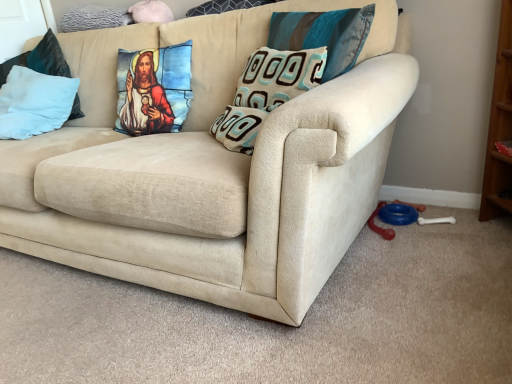
The image size is (512, 384). What do you see at coordinates (154, 89) in the screenshot? I see `printed fabric pillow at center, placed as the 4th pillow when sorted from right to left` at bounding box center [154, 89].

The width and height of the screenshot is (512, 384). What do you see at coordinates (34, 103) in the screenshot?
I see `light blue plush pillow at left, which appears as the first pillow when viewed from the left` at bounding box center [34, 103].

You are a GUI agent. You are given a task and a screenshot of the screen. Output one action in this format:
    pyautogui.click(x=<x>, y=<y>)
    Task: Click on the teal fabric pillow at upper center, which is counted as the fifth pillow, starting from the left
    This screenshot has height=384, width=512.
    Given the screenshot: What is the action you would take?
    pyautogui.click(x=324, y=35)

Between teal fabric pillow at upper center, which is counted as the fifth pillow, starting from the left, and printed fabric pillow at center, placed as the 4th pillow when sorted from right to left, which one has more height?

printed fabric pillow at center, placed as the 4th pillow when sorted from right to left, is taller.

Is teal fabric pillow at upper center, the first pillow from the right, with printed fabric pillow at center, placed as the 4th pillow when sorted from right to left?

teal fabric pillow at upper center, the first pillow from the right, and printed fabric pillow at center, placed as the 4th pillow when sorted from right to left, are clearly separated.

Is teal fabric pillow at upper center, which is counted as the fifth pillow, starting from the left, facing towards printed fabric pillow at center, marked as the 2th pillow in a left-to-right arrangement?

No.

From a real-world perspective, does teal fabric pillow at upper center, the first pillow from the right, stand above printed fabric pillow at center, placed as the 4th pillow when sorted from right to left?

Yes.

Is printed fabric pillow at center, marked as the 2th pillow in a left-to-right arrangement, oriented towards teal fabric pillow at upper center, which is the 3th pillow from left to right?

No, printed fabric pillow at center, marked as the 2th pillow in a left-to-right arrangement, is not aimed at teal fabric pillow at upper center, which is the 3th pillow from left to right.

Considering the relative positions of printed fabric pillow at center, placed as the 4th pillow when sorted from right to left, and teal fabric pillow at upper center, which is the 3th pillow from left to right, in the image provided, is printed fabric pillow at center, placed as the 4th pillow when sorted from right to left, to the right of teal fabric pillow at upper center, which is the 3th pillow from left to right, from the viewer's perspective?

Incorrect, printed fabric pillow at center, placed as the 4th pillow when sorted from right to left, is not on the right side of teal fabric pillow at upper center, which is the 3th pillow from left to right.

Can you tell me how much printed fabric pillow at center, marked as the 2th pillow in a left-to-right arrangement, and teal fabric pillow at upper center, which is the 3th pillow from left to right, differ in facing direction?

7.07e-05 degrees separate the facing orientations of printed fabric pillow at center, marked as the 2th pillow in a left-to-right arrangement, and teal fabric pillow at upper center, which is the 3th pillow from left to right.

From the image's perspective, which is above, printed fabric pillow at center, marked as the 2th pillow in a left-to-right arrangement, or teal fabric pillow at upper center, which is the 3th pillow from left to right?

teal fabric pillow at upper center, which is the 3th pillow from left to right, from the image's perspective.

Considering the relative positions of teal fabric pillow at upper center, the first pillow from the right, and light blue plush pillow at left, which appears as the first pillow when viewed from the left, in the image provided, is teal fabric pillow at upper center, the first pillow from the right, behind light blue plush pillow at left, which appears as the first pillow when viewed from the left,?

No, teal fabric pillow at upper center, the first pillow from the right, is in front of light blue plush pillow at left, which appears as the first pillow when viewed from the left.

Is teal fabric pillow at upper center, which is counted as the fifth pillow, starting from the left, turned away from light blue plush pillow at left, which appears as the first pillow when viewed from the left?

No.

Between point (319, 22) and point (23, 77), which one is positioned in front?

The point (319, 22) is closer.

From the image's perspective, which one is positioned lower, teal fabric pillow at upper center, the first pillow from the right, or light blue plush pillow at left, the 5th pillow viewed from the right?

light blue plush pillow at left, the 5th pillow viewed from the right, from the image's perspective.

From a real-world perspective, starting from the teal and brown textured pillow at center, acting as the second pillow starting from the right, which pillow is the 1st one vertically above it? Please provide its 2D coordinates.

[(154, 89)]

Considering the positions of objects teal and brown textured pillow at center, the fourth pillow viewed from the left, and printed fabric pillow at center, placed as the 4th pillow when sorted from right to left, in the image provided, who is behind, teal and brown textured pillow at center, the fourth pillow viewed from the left, or printed fabric pillow at center, placed as the 4th pillow when sorted from right to left,?

printed fabric pillow at center, placed as the 4th pillow when sorted from right to left, is more distant.

Which point is more forward, (272, 63) or (179, 98)?

The point (272, 63) is closer.

From the image's perspective, between teal and brown textured pillow at center, the fourth pillow viewed from the left, and printed fabric pillow at center, placed as the 4th pillow when sorted from right to left, who is located below?

teal and brown textured pillow at center, the fourth pillow viewed from the left, from the image's perspective.

Which pillow is the 2nd one when counting from the back of the printed fabric pillow at center, placed as the 4th pillow when sorted from right to left? Please provide its 2D coordinates.

[(34, 103)]

Considering the positions of objects light blue plush pillow at left, the 5th pillow viewed from the right, and printed fabric pillow at center, placed as the 4th pillow when sorted from right to left, in the image provided, who is more to the right, light blue plush pillow at left, the 5th pillow viewed from the right, or printed fabric pillow at center, placed as the 4th pillow when sorted from right to left,?

printed fabric pillow at center, placed as the 4th pillow when sorted from right to left.

Which object is further away from the camera, light blue plush pillow at left, which appears as the first pillow when viewed from the left, or printed fabric pillow at center, placed as the 4th pillow when sorted from right to left?

light blue plush pillow at left, which appears as the first pillow when viewed from the left, is more distant.

Is light blue plush pillow at left, the 5th pillow viewed from the right, aimed at printed fabric pillow at center, placed as the 4th pillow when sorted from right to left?

No, light blue plush pillow at left, the 5th pillow viewed from the right, is not facing towards printed fabric pillow at center, placed as the 4th pillow when sorted from right to left.

Find the location of a particular element. studio couch below the printed fabric pillow at center, marked as the 2th pillow in a left-to-right arrangement (from a real-world perspective) is located at coordinates (211, 171).

Considering the sizes of objects printed fabric pillow at center, placed as the 4th pillow when sorted from right to left, and beige fabric couch at center in the image provided, who is taller, printed fabric pillow at center, placed as the 4th pillow when sorted from right to left, or beige fabric couch at center?

beige fabric couch at center is taller.

Would you say printed fabric pillow at center, placed as the 4th pillow when sorted from right to left, is to the left or to the right of beige fabric couch at center in the picture?

printed fabric pillow at center, placed as the 4th pillow when sorted from right to left, is to the right of beige fabric couch at center.

Looking at the image, does printed fabric pillow at center, placed as the 4th pillow when sorted from right to left, seem bigger or smaller compared to beige fabric couch at center?

In the image, printed fabric pillow at center, placed as the 4th pillow when sorted from right to left, appears to be smaller than beige fabric couch at center.

From a real-world perspective, who is located lower, printed fabric pillow at center, marked as the 2th pillow in a left-to-right arrangement, or teal fabric pillow at upper center, which is counted as the fifth pillow, starting from the left?

In real-world perspective, printed fabric pillow at center, marked as the 2th pillow in a left-to-right arrangement, is lower.

Considering the positions of points (156, 112) and (356, 57), is point (156, 112) farther from camera compared to point (356, 57)?

That is True.

Can teal fabric pillow at upper center, the first pillow from the right, be found inside printed fabric pillow at center, marked as the 2th pillow in a left-to-right arrangement?

No.

Image resolution: width=512 pixels, height=384 pixels. There is a teal fabric pillow at upper center, which is counted as the fifth pillow, starting from the left. Find the location of `the 1st pillow below it (from the image's perspective)`. the 1st pillow below it (from the image's perspective) is located at coordinates (154, 89).

From the image's perspective, which pillow is the 2nd one above the printed fabric pillow at center, placed as the 4th pillow when sorted from right to left? Please provide its 2D coordinates.

[(225, 6)]

From the image, which object appears to be farther from teal fabric pillow at upper center, which is counted as the fifth pillow, starting from the left, printed fabric pillow at center, placed as the 4th pillow when sorted from right to left, or teal and brown textured pillow at center, the fourth pillow viewed from the left?

printed fabric pillow at center, placed as the 4th pillow when sorted from right to left, is positioned further to the anchor teal fabric pillow at upper center, which is counted as the fifth pillow, starting from the left.

Based on their spatial positions, is printed fabric pillow at center, marked as the 2th pillow in a left-to-right arrangement, or beige fabric couch at center closer to teal fabric pillow at upper center, the 3th pillow in the right-to-left sequence?

Based on the image, printed fabric pillow at center, marked as the 2th pillow in a left-to-right arrangement, appears to be nearer to teal fabric pillow at upper center, the 3th pillow in the right-to-left sequence.

From the image, which object appears to be farther from teal fabric pillow at upper center, which is the 3th pillow from left to right, teal and brown textured pillow at center, the fourth pillow viewed from the left, or teal fabric pillow at upper center, the first pillow from the right?

teal and brown textured pillow at center, the fourth pillow viewed from the left, is positioned further to the anchor teal fabric pillow at upper center, which is the 3th pillow from left to right.

Based on their spatial positions, is teal fabric pillow at upper center, the 3th pillow in the right-to-left sequence, or teal and brown textured pillow at center, acting as the second pillow starting from the right, closer to light blue plush pillow at left, the 5th pillow viewed from the right?

teal fabric pillow at upper center, the 3th pillow in the right-to-left sequence, lies closer to light blue plush pillow at left, the 5th pillow viewed from the right, than the other object.

In the scene shown: Estimate the real-world distances between objects in this image. Which object is further from beige fabric couch at center, teal fabric pillow at upper center, which is counted as the fifth pillow, starting from the left, or light blue plush pillow at left, which appears as the first pillow when viewed from the left?

Among the two, light blue plush pillow at left, which appears as the first pillow when viewed from the left, is located further to beige fabric couch at center.

Based on their spatial positions, is teal fabric pillow at upper center, which is counted as the fifth pillow, starting from the left, or teal fabric pillow at upper center, which is the 3th pillow from left to right, closer to teal and brown textured pillow at center, acting as the second pillow starting from the right?

teal fabric pillow at upper center, which is counted as the fifth pillow, starting from the left, is closer to teal and brown textured pillow at center, acting as the second pillow starting from the right.

When comparing their distances from teal fabric pillow at upper center, the first pillow from the right, does printed fabric pillow at center, marked as the 2th pillow in a left-to-right arrangement, or teal fabric pillow at upper center, which is the 3th pillow from left to right, seem closer?

Based on the image, teal fabric pillow at upper center, which is the 3th pillow from left to right, appears to be nearer to teal fabric pillow at upper center, the first pillow from the right.

Which object lies further to the anchor point teal and brown textured pillow at center, the fourth pillow viewed from the left, beige fabric couch at center or teal fabric pillow at upper center, which is the 3th pillow from left to right?

The object further to teal and brown textured pillow at center, the fourth pillow viewed from the left, is teal fabric pillow at upper center, which is the 3th pillow from left to right.

Where is `studio couch situated between light blue plush pillow at left, which appears as the first pillow when viewed from the left, and teal and brown textured pillow at center, acting as the second pillow starting from the right, from left to right`? The height and width of the screenshot is (384, 512). studio couch situated between light blue plush pillow at left, which appears as the first pillow when viewed from the left, and teal and brown textured pillow at center, acting as the second pillow starting from the right, from left to right is located at coordinates (211, 171).

This screenshot has height=384, width=512. I want to click on pillow between light blue plush pillow at left, the 5th pillow viewed from the right, and teal fabric pillow at upper center, the 3th pillow in the right-to-left sequence, so click(x=154, y=89).

Where is `studio couch between light blue plush pillow at left, which appears as the first pillow when viewed from the left, and teal fabric pillow at upper center, which is counted as the fifth pillow, starting from the left, from left to right`? This screenshot has height=384, width=512. studio couch between light blue plush pillow at left, which appears as the first pillow when viewed from the left, and teal fabric pillow at upper center, which is counted as the fifth pillow, starting from the left, from left to right is located at coordinates (211, 171).